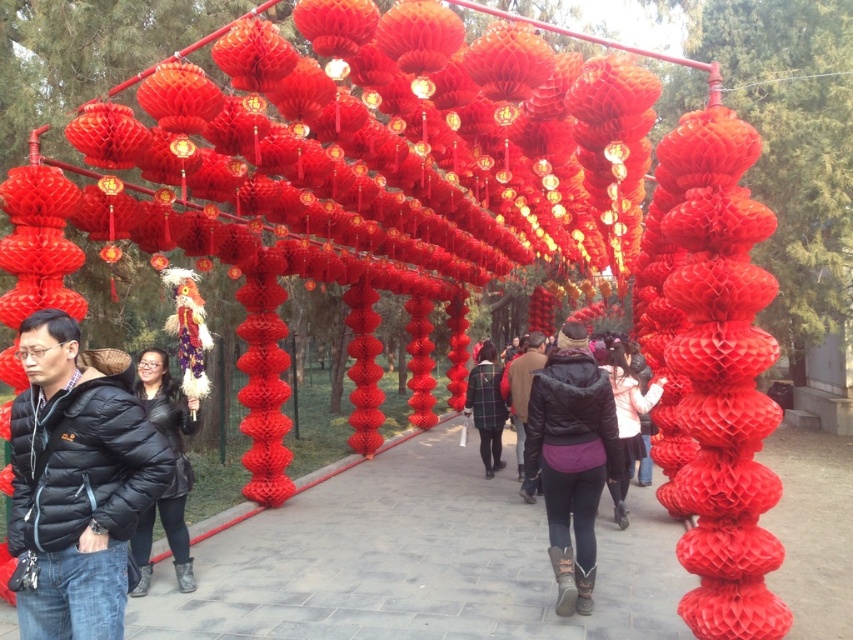
You are standing at the entrance of the lantern path and want to give a gift to someone wearing either the purple fleece jacket at center or the matte black jacket at center. If you can only reach 34 inches, can you hand the gift to them without moving closer?

The purple fleece jacket at center and the matte black jacket at center are 35.40 inches apart from each other, so no, you cannot hand the gift to them without moving closer since the distance is greater than your reach of 34 inches.

You are organizing a winter photoshoot and need to ensure all clothing items are visible in the frame. Given that the purple fleece jacket at center and the matte black jacket at center are both in the shot, which one might require more careful framing to ensure it doesn not get lost in the background?

The purple fleece jacket at center occupies less space than the matte black jacket at center, so the purple fleece jacket at center might require more careful framing to ensure it doesn not get lost in the background.

You are a photographer trying to capture a group photo of the matte black jacket at center and the plaid shirt at center. Since the two are standing close to each other, you need to adjust your camera to ensure both are in focus. Which subject should you focus on to account for their size difference?

You should focus on the matte black jacket at center because it is wider than the plaid shirt at center, ensuring the larger subject is in focus while the smaller one remains sharp as well.